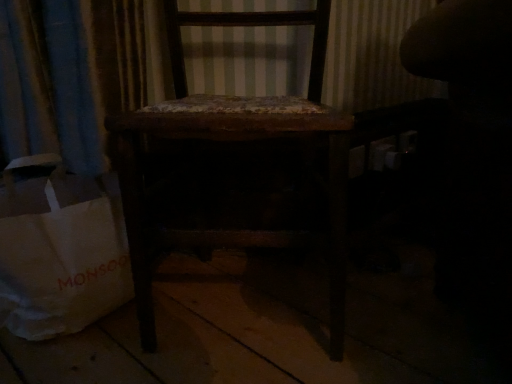
The height and width of the screenshot is (384, 512). Find the location of `vacant space underneath white paper bag at lower left (from a real-world perspective)`. vacant space underneath white paper bag at lower left (from a real-world perspective) is located at coordinates (50, 342).